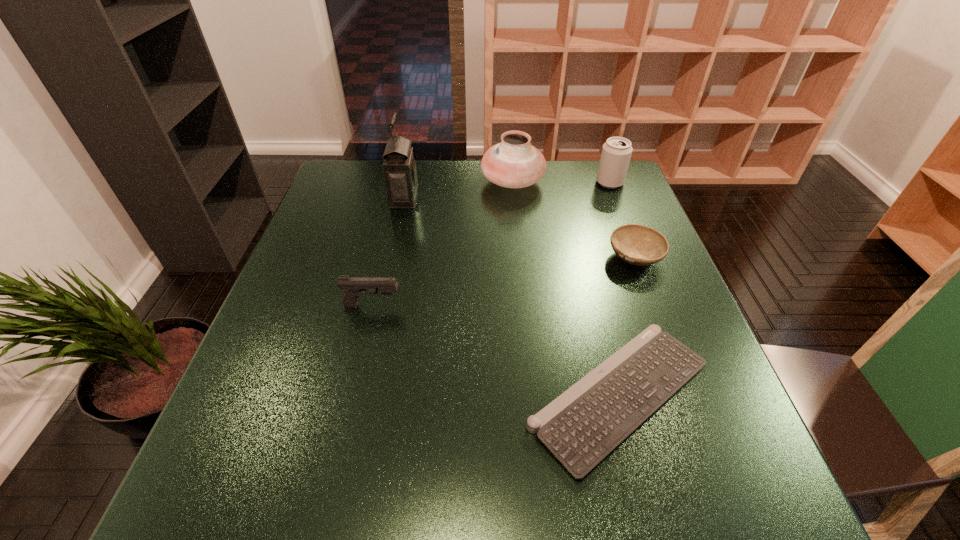
What are the coordinates of `can that is at the right edge` in the screenshot? It's located at (616, 153).

Locate an element on the screen. This screenshot has width=960, height=540. bowl positioned at the right edge is located at coordinates coord(639,245).

The width and height of the screenshot is (960, 540). I want to click on computer keyboard that is positioned at the right edge, so click(x=582, y=426).

Identify the location of object that is positioned at the far right corner. Image resolution: width=960 pixels, height=540 pixels. (616, 153).

At what (x,y) coordinates should I click in order to perform the action: click on object that is at the near right corner. Please return your answer as a coordinate pair (x, y). This screenshot has width=960, height=540. Looking at the image, I should click on point(582,426).

What are the coordinates of `blank space at the far edge` in the screenshot? It's located at (478, 188).

You are a GUI agent. You are given a task and a screenshot of the screen. Output one action in this format:
    pyautogui.click(x=<x>, y=<y>)
    Task: Click on the vacant area at the near edge of the desktop
    This screenshot has height=540, width=960.
    Given the screenshot: What is the action you would take?
    tap(588, 495)

In the image, there is a desktop. Identify the location of vacant space at the left edge. This screenshot has width=960, height=540. (317, 353).

I want to click on vacant space at the right edge of the desktop, so 668,323.

Where is `free space at the far left corner of the desktop`? free space at the far left corner of the desktop is located at coordinates (362, 163).